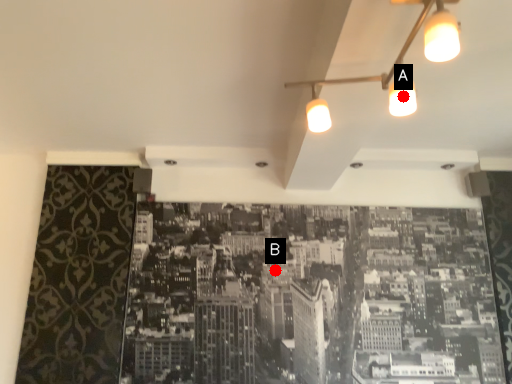
Question: Two points are circled on the image, labeled by A and B beside each circle. Which of the following is the farthest from the observer?

Choices:
 (A) A is further
 (B) B is further

Answer: (B)